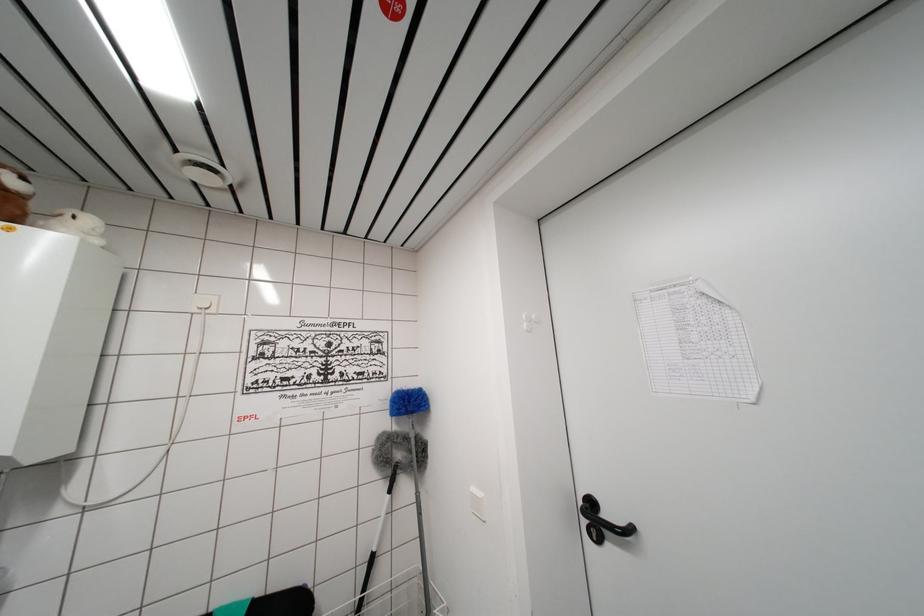
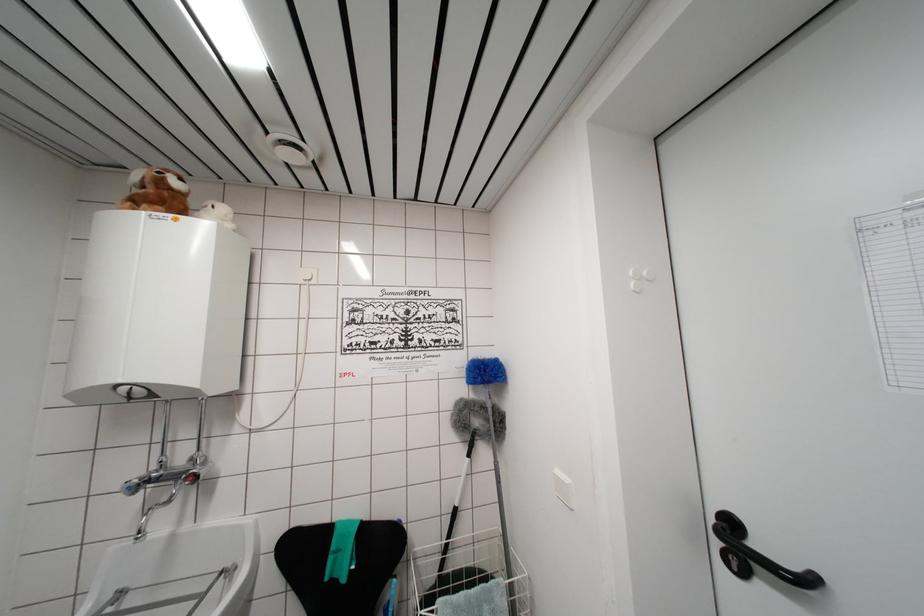
The point at (530, 326) is marked in the first image. Where is the corresponding point in the second image?

(638, 285)